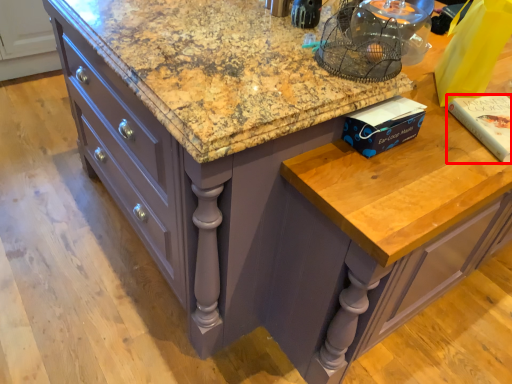
Question: In this image, where is book (annotated by the red box) located relative to book?

Choices:
 (A) left
 (B) right

Answer: (B)